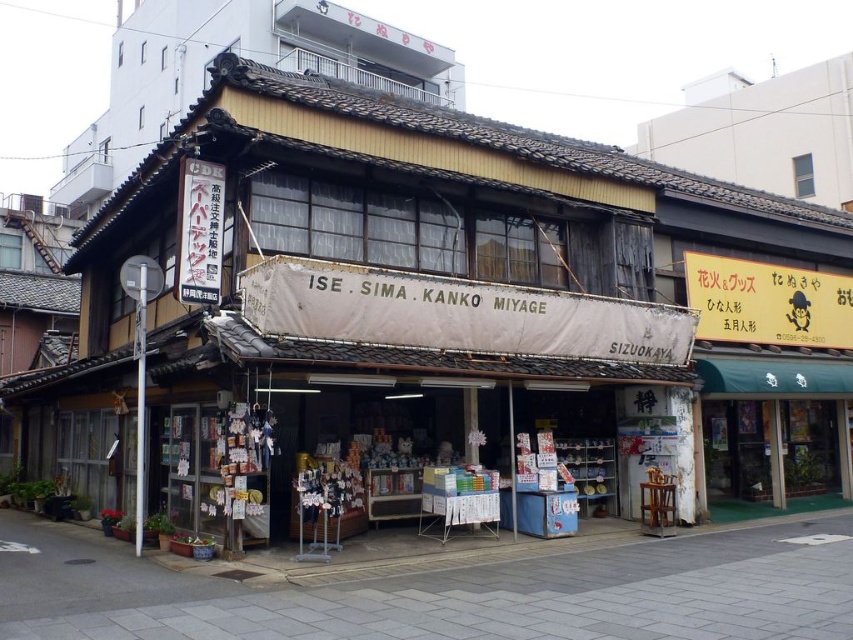
You are standing in front of the traditional Japanese storefront. The shop has an open entrance with shelves inside. You want to read the text on the yellow paper sign at upper right. Considering the distance, can you read the text clearly without moving closer?

The yellow paper sign at upper right is 13.84 meters away from the camera. At this distance, it might be difficult to read the text clearly without moving closer.

You are standing in front of the traditional Japanese storefront and want to read both the yellow paper sign at upper right and the black paper sign at upper left. Which sign will you be able to read first without moving your position?

The yellow paper sign at upper right is closer to you, so you can read it first without moving your position because it is further to the viewer than the black paper sign at upper left.

You are a tourist standing in front of the ISE.SIMA.KANKO MIYAGE store. You notice two signs above the entrance. The yellow paper sign at upper right and the black paper sign at upper left. Which sign is larger?

The yellow paper sign at upper right is bigger than the black paper sign at upper left.